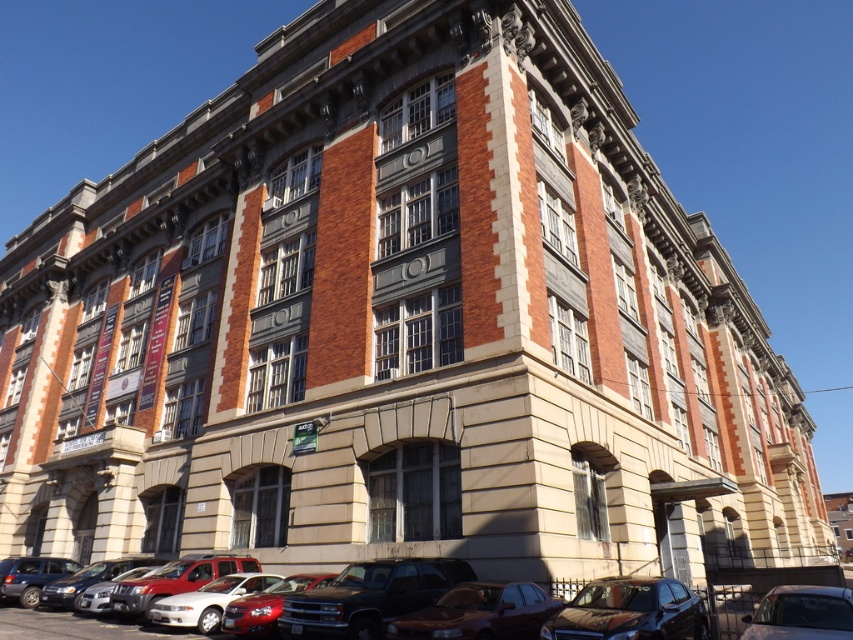
Which is above, shiny black sedan at lower center or matte black suv at lower left?

shiny black sedan at lower center is above.

From the picture: Does shiny black sedan at lower center appear over matte black suv at lower left?

Yes.

Image resolution: width=853 pixels, height=640 pixels. Find the location of `shiny black sedan at lower center`. shiny black sedan at lower center is located at coordinates (630, 611).

Can you confirm if shiny black suv at lower center is shorter than shiny black sedan at lower center?

Yes.

Can you confirm if shiny black suv at lower center is positioned below shiny black sedan at lower center?

Correct, shiny black suv at lower center is located below shiny black sedan at lower center.

Find the location of `shiny black suv at lower center`. shiny black suv at lower center is located at coordinates (369, 596).

Between shiny black sedan at lower center and white glossy sedan at lower center, which one appears on the right side from the viewer's perspective?

From the viewer's perspective, shiny black sedan at lower center appears more on the right side.

Is point (590, 582) positioned before point (279, 579)?

Yes, point (590, 582) is in front of point (279, 579).

Image resolution: width=853 pixels, height=640 pixels. I want to click on shiny black sedan at lower center, so click(x=630, y=611).